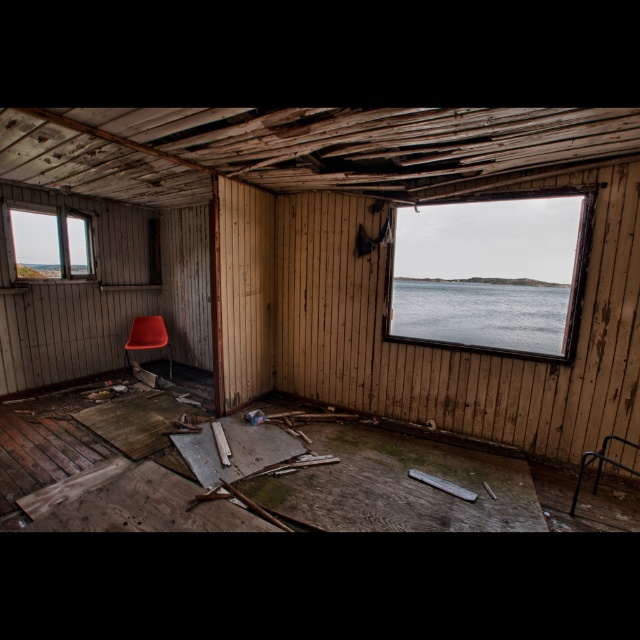
Question: Which point is farther from the camera taking this photo?

Choices:
 (A) 534,348
 (B) 588,349
 (C) 164,344
 (D) 13,227

Answer: (A)

Question: Is blue water at window right above matte orange armchair at center?

Choices:
 (A) no
 (B) yes

Answer: (B)

Question: Which of the following is the farthest from the observer?

Choices:
 (A) (557, 445)
 (B) (77, 227)
 (C) (544, 316)

Answer: (C)

Question: Which point is closer to the camera?

Choices:
 (A) matte orange armchair at center
 (B) blue water at window right
 (C) matte plastic chair at center left

Answer: (C)

Question: Is matte plastic chair at center left behind blue water at window right?

Choices:
 (A) yes
 (B) no

Answer: (B)

Question: Can you confirm if transparent glass window at upper left is wider than matte orange armchair at center?

Choices:
 (A) no
 (B) yes

Answer: (B)